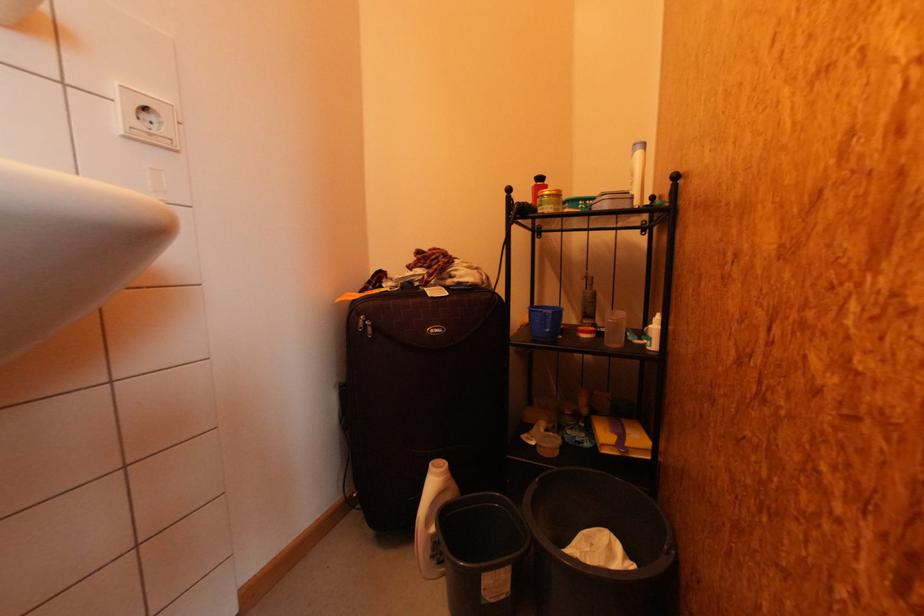
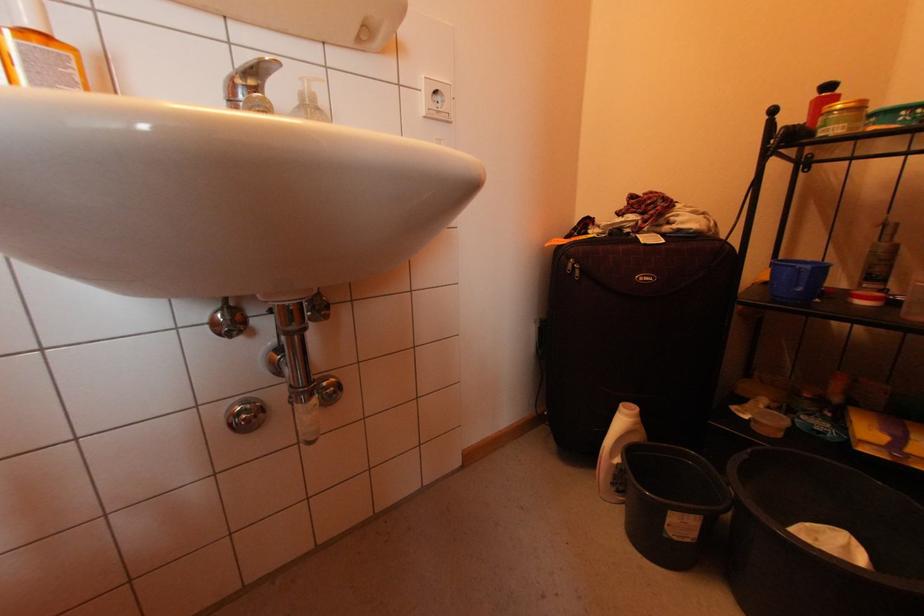
In the second image, find the point that corresponds to point 545,179 in the first image.

(833, 87)